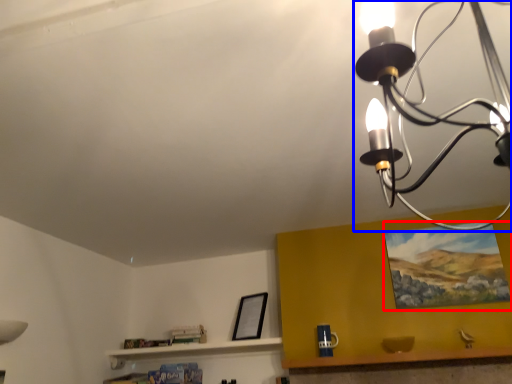
Question: Which object appears closest to the camera in this image, picture frame (highlighted by a red box) or lamp (highlighted by a blue box)?

Choices:
 (A) picture frame
 (B) lamp

Answer: (B)